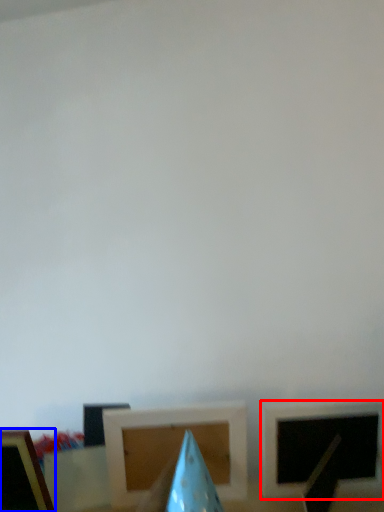
Question: Which point is further to the camera, picture frame (highlighted by a red box) or picture frame (highlighted by a blue box)?

Choices:
 (A) picture frame
 (B) picture frame

Answer: (A)